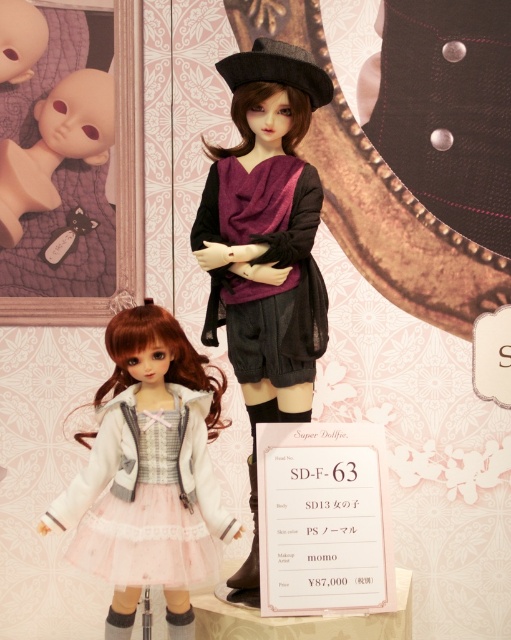
Question: Which point appears closest to the camera in this image?

Choices:
 (A) (248, 349)
 (B) (11, 205)

Answer: (A)

Question: Is matte black doll at center thinner than pale pink tulle dress at lower left?

Choices:
 (A) no
 (B) yes

Answer: (B)

Question: Is matte black doll at center positioned behind pale pink tulle dress at lower left?

Choices:
 (A) no
 (B) yes

Answer: (B)

Question: Estimate the real-world distances between objects in this image. Which object is farther from the matte black doll at center?

Choices:
 (A) pale pink tulle dress at lower left
 (B) purple sheer scarf at center
 (C) matte black doll at upper left

Answer: (C)

Question: Which object appears farthest from the camera in this image?

Choices:
 (A) matte black doll at center
 (B) matte black doll at upper left
 (C) pale pink tulle dress at lower left

Answer: (B)

Question: Does pale pink tulle dress at lower left have a lesser width compared to purple sheer scarf at center?

Choices:
 (A) yes
 (B) no

Answer: (B)